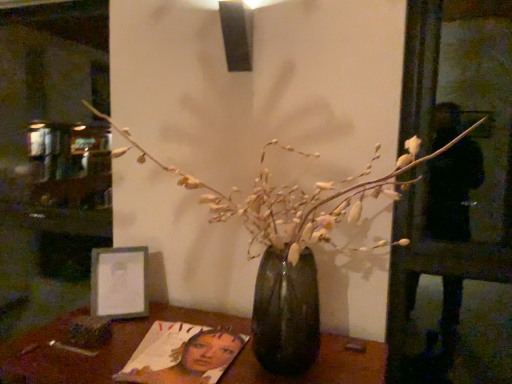
At what (x,y) coordinates should I click in order to perform the action: click on unoccupied space behind matte paper magazine at lower center. Please return your answer as a coordinate pair (x, y). The image size is (512, 384). Looking at the image, I should click on (195, 321).